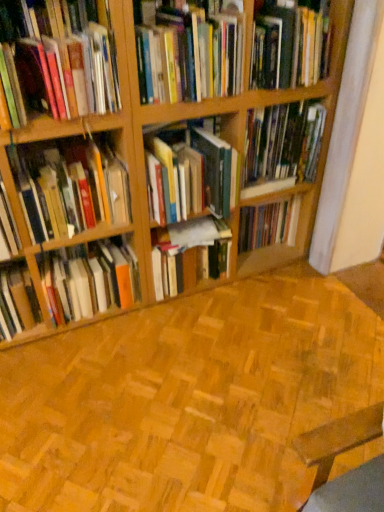
Question: Are hardcover book at center, positioned as the eighth book in top-to-bottom order, and hardcover book at upper right, acting as the first book starting from the top, far apart?

Choices:
 (A) yes
 (B) no

Answer: (B)

Question: From the image's perspective, is hardcover book at center, positioned as the eighth book in top-to-bottom order, on hardcover book at upper right, acting as the 9th book starting from the bottom?

Choices:
 (A) yes
 (B) no

Answer: (B)

Question: Can you confirm if hardcover book at center, which appears as the second book when ordered from the bottom, is smaller than hardcover book at upper right, acting as the first book starting from the top?

Choices:
 (A) yes
 (B) no

Answer: (A)

Question: From a real-world perspective, does hardcover book at center, positioned as the eighth book in top-to-bottom order, stand above hardcover book at upper right, acting as the 9th book starting from the bottom?

Choices:
 (A) no
 (B) yes

Answer: (A)

Question: Considering the relative sizes of hardcover book at center, positioned as the eighth book in top-to-bottom order, and hardcover book at upper right, acting as the 9th book starting from the bottom, in the image provided, is hardcover book at center, positioned as the eighth book in top-to-bottom order, shorter than hardcover book at upper right, acting as the 9th book starting from the bottom,?

Choices:
 (A) yes
 (B) no

Answer: (A)

Question: Can you confirm if hardcover book at center, which appears as the second book when ordered from the bottom, is bigger than hardcover book at upper right, acting as the 9th book starting from the bottom?

Choices:
 (A) no
 (B) yes

Answer: (A)

Question: Is hardcover books at center, arranged as the fifth book when ordered from the bottom, surrounded by wooden parquet flooring at center?

Choices:
 (A) no
 (B) yes

Answer: (A)

Question: Does wooden parquet flooring at center have a lesser height compared to hardcover books at center, arranged as the fifth book when ordered from the bottom?

Choices:
 (A) yes
 (B) no

Answer: (A)

Question: Is there a large distance between wooden parquet flooring at center and hardcover books at center, marked as the fifth book in a top-to-bottom arrangement?

Choices:
 (A) no
 (B) yes

Answer: (A)

Question: Is wooden parquet flooring at center thinner than hardcover books at center, marked as the fifth book in a top-to-bottom arrangement?

Choices:
 (A) no
 (B) yes

Answer: (A)

Question: From the image's perspective, does wooden parquet flooring at center appear higher than hardcover books at center, arranged as the fifth book when ordered from the bottom?

Choices:
 (A) yes
 (B) no

Answer: (B)

Question: Is wooden parquet flooring at center in front of hardcover books at center, arranged as the fifth book when ordered from the bottom?

Choices:
 (A) no
 (B) yes

Answer: (B)

Question: Is hardcover books at center, which is counted as the 9th book, starting from the top, not inside hardcover book at center, which is the 7th book from top to bottom?

Choices:
 (A) no
 (B) yes

Answer: (B)